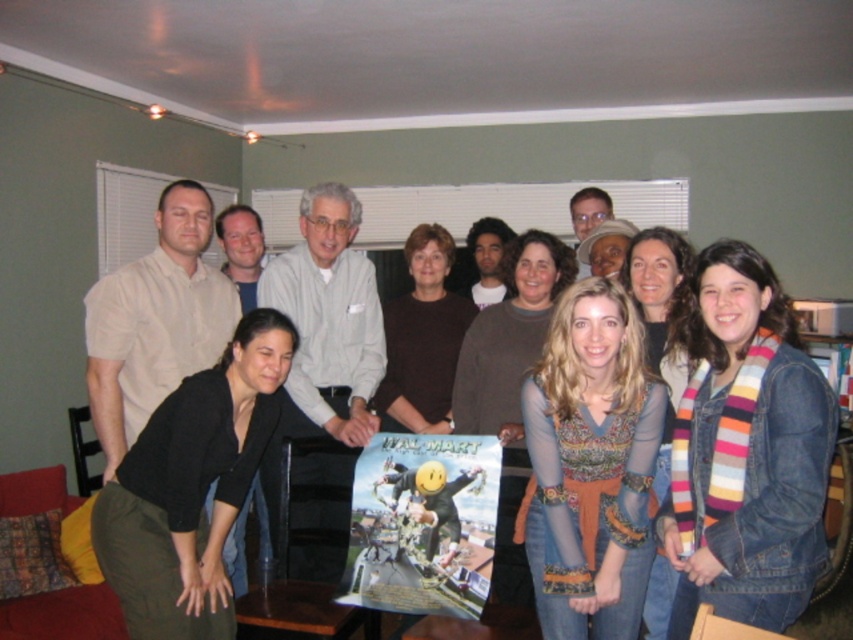
You are a photographer trying to capture a candid shot of the brown matte sweater at center and the black matte pants at lower left. Since you want to ensure both are in focus, you need to know their vertical positions. Which object is positioned lower in the image?

The black matte pants at lower left is located below the brown matte sweater at center, so it is positioned lower in the image.

You are a photographer trying to capture a group photo. You notice the printed fabric sweater at center and the brown matte sweater at center. Which sweater should you adjust to ensure both are visible in the photo?

The printed fabric sweater at center is in front of the brown matte sweater at center, so you should adjust the brown matte sweater at center to move it forward so both can be seen.

Consider the image. You are organizing a photo shoot and need to ensure that all clothing items in the image are appropriately sized for the models. Given that the black matte pants at lower left and the brown matte sweater at center are part of the wardrobe, which clothing item requires a larger size?

The black matte pants at lower left requires a larger size than the brown matte sweater at center because it is larger in size.